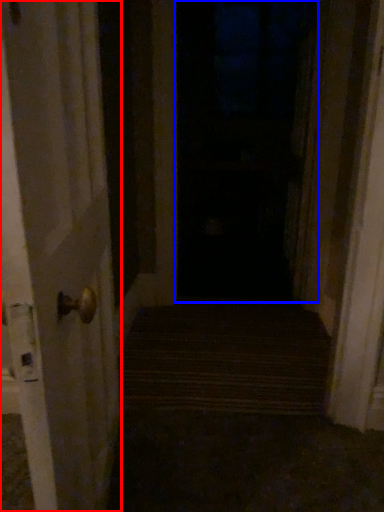
Question: Which of the following is the closest to the observer, door (highlighted by a red box) or window (highlighted by a blue box)?

Choices:
 (A) door
 (B) window

Answer: (A)